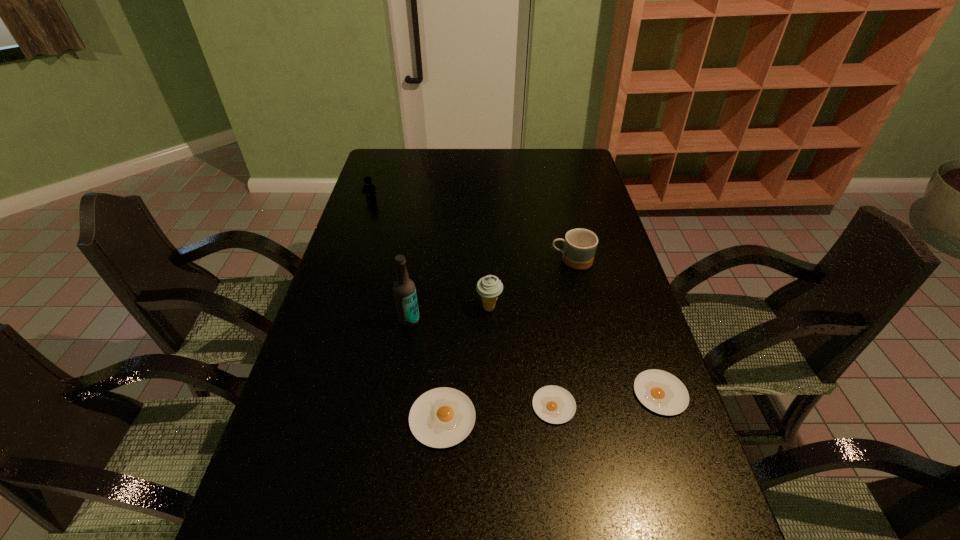
In order to click on vacant place for an extra egg yolk on the left in this screenshot , I will do `click(325, 431)`.